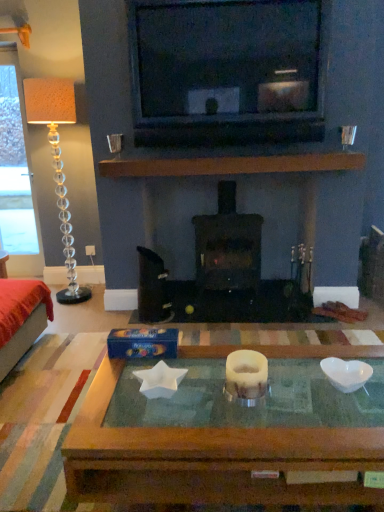
Question: Does translucent glass floor lamp at left appear on the left side of velvet red ottoman at left?

Choices:
 (A) no
 (B) yes

Answer: (A)

Question: Does translucent glass floor lamp at left have a lesser height compared to velvet red ottoman at left?

Choices:
 (A) no
 (B) yes

Answer: (A)

Question: Is translucent glass floor lamp at left taller than velvet red ottoman at left?

Choices:
 (A) no
 (B) yes

Answer: (B)

Question: From a real-world perspective, is translucent glass floor lamp at left under velvet red ottoman at left?

Choices:
 (A) yes
 (B) no

Answer: (B)

Question: From the image's perspective, does translucent glass floor lamp at left appear lower than velvet red ottoman at left?

Choices:
 (A) yes
 (B) no

Answer: (B)

Question: Can you confirm if translucent glass floor lamp at left is thinner than velvet red ottoman at left?

Choices:
 (A) no
 (B) yes

Answer: (B)

Question: Is black matte wood burning stove at center not within translucent glass floor lamp at left?

Choices:
 (A) no
 (B) yes

Answer: (B)

Question: Can you confirm if black matte wood burning stove at center is positioned to the left of translucent glass floor lamp at left?

Choices:
 (A) yes
 (B) no

Answer: (B)

Question: From a real-world perspective, is black matte wood burning stove at center positioned over translucent glass floor lamp at left based on gravity?

Choices:
 (A) yes
 (B) no

Answer: (B)

Question: Considering the relative positions of black matte wood burning stove at center and translucent glass floor lamp at left in the image provided, is black matte wood burning stove at center to the right of translucent glass floor lamp at left from the viewer's perspective?

Choices:
 (A) yes
 (B) no

Answer: (A)

Question: Considering the relative sizes of black matte wood burning stove at center and translucent glass floor lamp at left in the image provided, is black matte wood burning stove at center bigger than translucent glass floor lamp at left?

Choices:
 (A) yes
 (B) no

Answer: (A)

Question: Is black matte wood burning stove at center smaller than translucent glass floor lamp at left?

Choices:
 (A) yes
 (B) no

Answer: (B)

Question: Is black matte wood burning stove at center turned away from translucent glass coffee table at center?

Choices:
 (A) yes
 (B) no

Answer: (B)